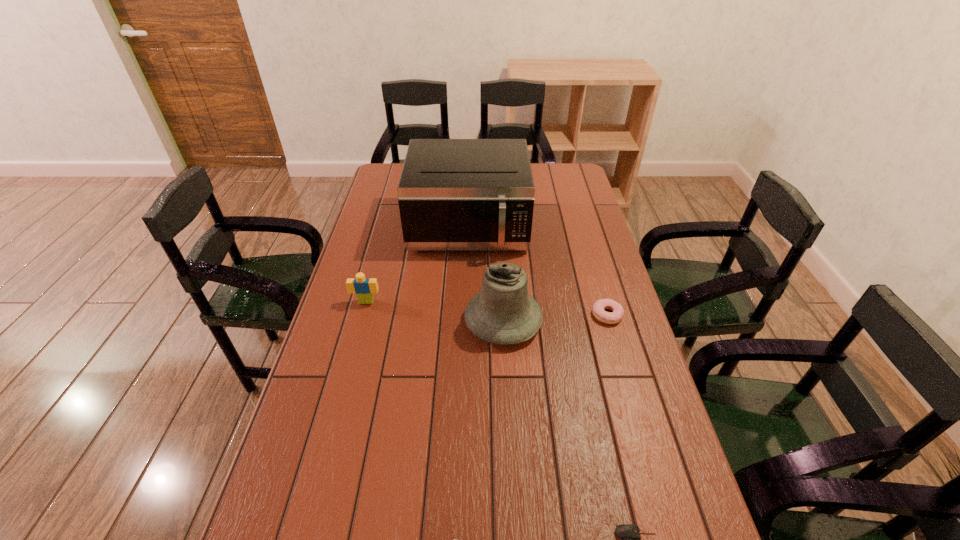
Locate an element on the screen. The width and height of the screenshot is (960, 540). object that stands as the second closest to the pinecone is located at coordinates (503, 313).

Where is `vacant space that satisfies the following two spatial constraints: 1. on the face of the doughnut; 2. on the left side of the third tallest object`? The height and width of the screenshot is (540, 960). vacant space that satisfies the following two spatial constraints: 1. on the face of the doughnut; 2. on the left side of the third tallest object is located at coordinates 363,315.

Identify the location of vacant area that satisfies the following two spatial constraints: 1. on the front-facing side of the tallest object; 2. on the right side of the second tallest object. Image resolution: width=960 pixels, height=540 pixels. (466, 321).

Identify the location of vacant space that satisfies the following two spatial constraints: 1. on the face of the second tallest object; 2. on the right side of the leftmost object. (361, 321).